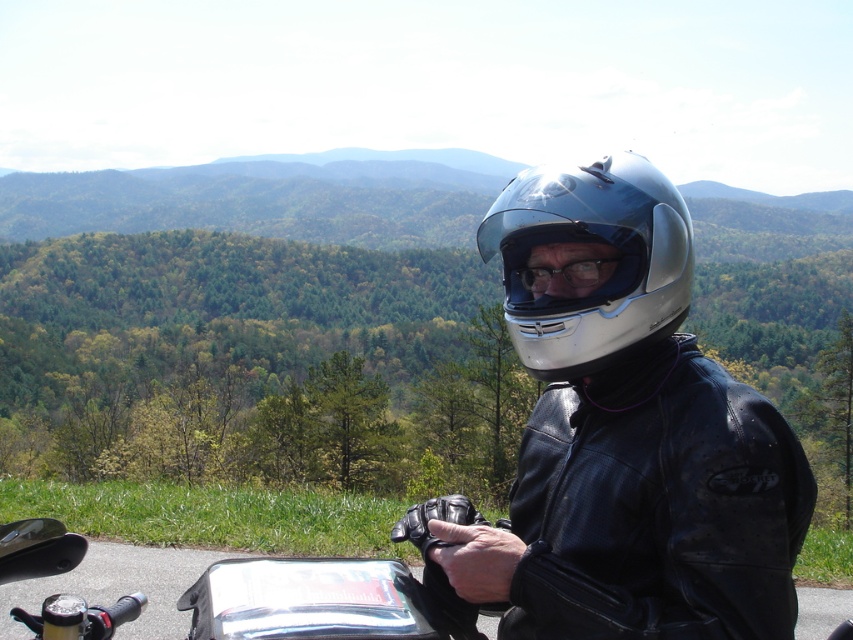
You are standing in front of the glossy black helmet at center. If you want to reach the motorcycle handlebars, which are 1.5 meters away from you, can you do so without moving your feet?

The glossy black helmet at center is 1.13 meters from viewer. Since the handlebars are 1.5 meters away, you would need to extend your arm or move closer to reach them, so you cannot reach them without moving your feet.

You are a photographer trying to capture a clear shot of the motorcyclist. You notice the glossy white helmet at center and the transparent plastic goggles at center. Which object is wider when viewed from your position?

The glossy white helmet at center is wider than the transparent plastic goggles at center.

You are a photographer trying to capture the motorcyclist and their gear. You want to ensure both the glossy white helmet at center and the transparent plastic goggles at center are visible in your shot. Based on their positions, which object should you focus on first to ensure both are in frame?

The glossy white helmet at center is located above transparent plastic goggles at center. Therefore, focusing on the glossy white helmet at center first will ensure the transparent plastic goggles at center are also within the frame since it is positioned below.